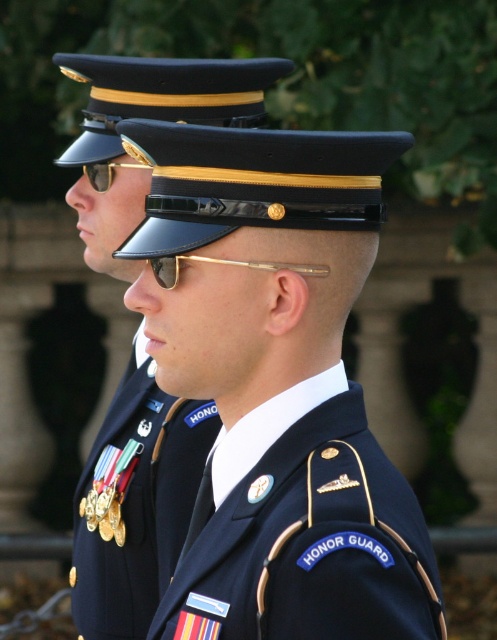
Question: Which object is positioned farthest from the navy blue fabric uniform at center?

Choices:
 (A) gold metallic medals at center
 (B) navy blue uniform at center
 (C) gold reflective sunglasses at upper center

Answer: (C)

Question: Is navy blue fabric uniform at center wider than gold reflective sunglasses at upper center?

Choices:
 (A) yes
 (B) no

Answer: (A)

Question: Which point is farther from the camera taking this photo?

Choices:
 (A) (108, 577)
 (B) (165, 397)

Answer: (B)

Question: Which point appears farthest from the camera in this image?

Choices:
 (A) (393, 554)
 (B) (92, 577)

Answer: (B)

Question: Can you confirm if navy blue fabric uniform at center is wider than navy blue uniform at center?

Choices:
 (A) no
 (B) yes

Answer: (B)

Question: Is navy blue uniform at center to the right of gold reflective sunglasses at upper center from the viewer's perspective?

Choices:
 (A) yes
 (B) no

Answer: (A)